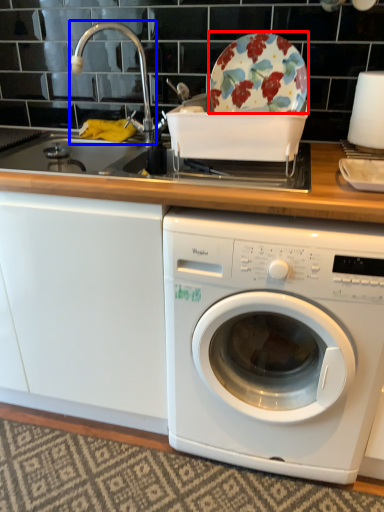
Question: Which object is closer to the camera taking this photo, table (highlighted by a red box) or faucet (highlighted by a blue box)?

Choices:
 (A) table
 (B) faucet

Answer: (A)